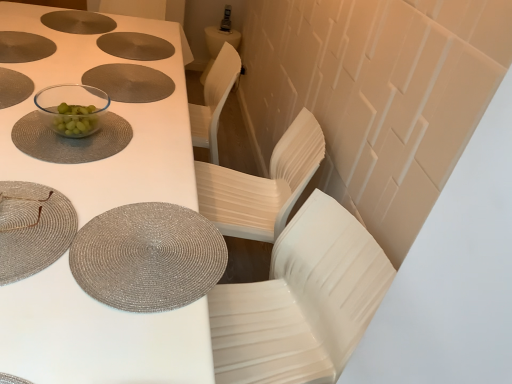
This screenshot has width=512, height=384. In order to click on vacant space that's between transparent glass bowl at center, the third tableware when ordered from top to bottom, and matte silver placemat at center in this screenshot , I will do `click(103, 100)`.